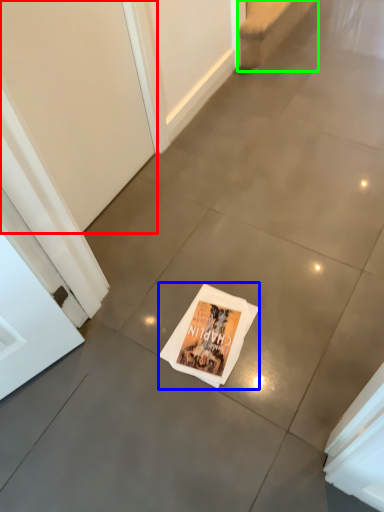
Question: Estimate the real-world distances between objects in this image. Which object is farther from screen door (highlighted by a red box), magazine (highlighted by a blue box) or stairwell (highlighted by a green box)?

Choices:
 (A) magazine
 (B) stairwell

Answer: (B)